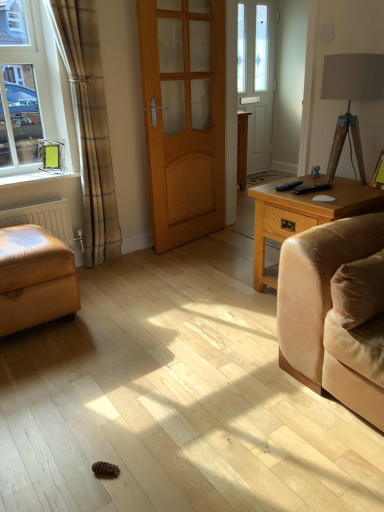
At what (x,y) coordinates should I click in order to perform the action: click on free space between light brown wooden side table at right and leather armchair at left. Please return your answer as a coordinate pair (x, y). This screenshot has height=512, width=384. Looking at the image, I should click on (177, 301).